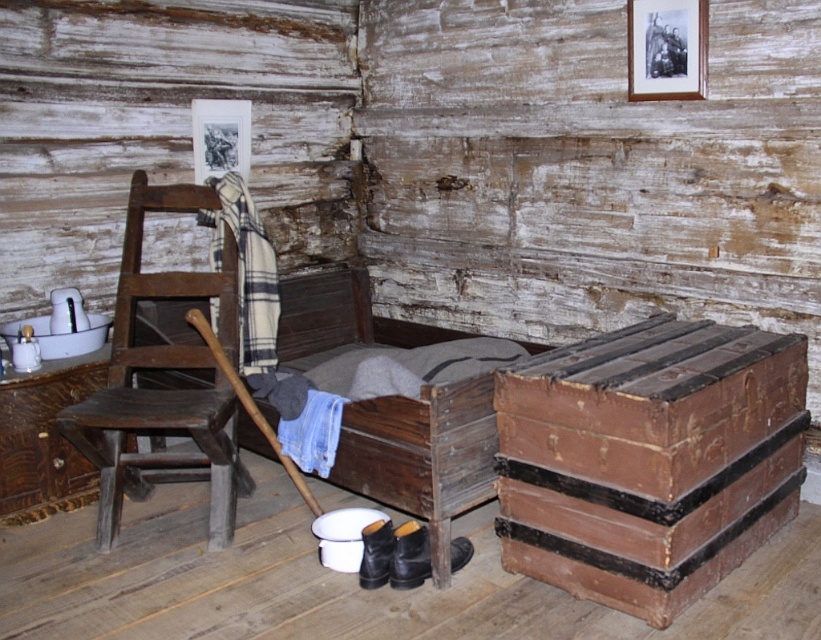
Is dark brown wood rocking chair at left to the right of black matte picture frame at upper left from the viewer's perspective?

Incorrect, dark brown wood rocking chair at left is not on the right side of black matte picture frame at upper left.

Does dark brown wood rocking chair at left have a greater width compared to black matte picture frame at upper left?

Correct, the width of dark brown wood rocking chair at left exceeds that of black matte picture frame at upper left.

Is point (95, 541) less distant than point (209, 99)?

Yes, it is in front of point (209, 99).

Image resolution: width=821 pixels, height=640 pixels. I want to click on dark brown wood rocking chair at left, so click(163, 388).

Is dark brown wood rocking chair at left thinner than wooden picture frame at upper right?

No, dark brown wood rocking chair at left is not thinner than wooden picture frame at upper right.

Consider the image. Which is more to the left, dark brown wood rocking chair at left or wooden picture frame at upper right?

From the viewer's perspective, dark brown wood rocking chair at left appears more on the left side.

You are a GUI agent. You are given a task and a screenshot of the screen. Output one action in this format:
    pyautogui.click(x=<x>, y=<y>)
    Task: Click on the dark brown wood rocking chair at left
    This screenshot has height=640, width=821.
    Given the screenshot: What is the action you would take?
    pyautogui.click(x=163, y=388)

Can you confirm if brown leather trunk at lower right is shorter than black matte picture frame at upper left?

In fact, brown leather trunk at lower right may be taller than black matte picture frame at upper left.

In the scene shown: Between brown leather trunk at lower right and black matte picture frame at upper left, which one is positioned lower?

brown leather trunk at lower right is lower down.

Locate an element on the screen. brown leather trunk at lower right is located at coordinates (649, 460).